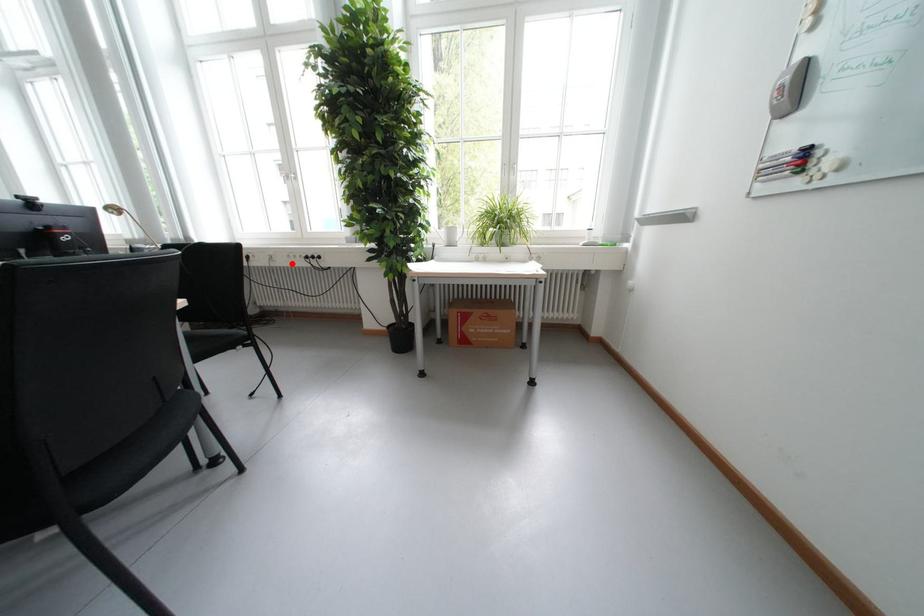
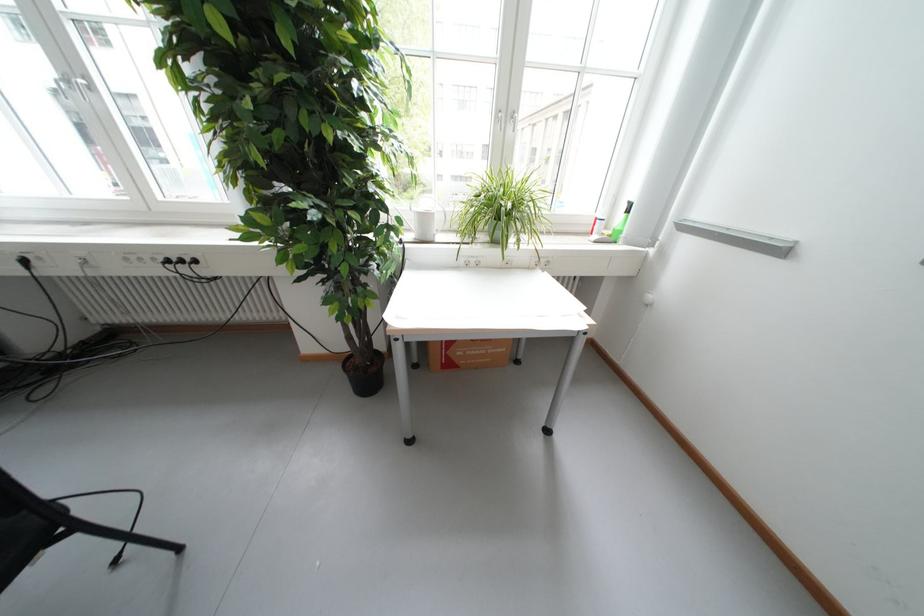
Where in the second image is the point corresponding to the highlighted location from the first image?

(124, 270)